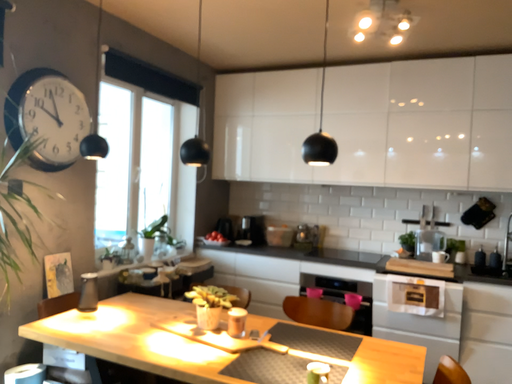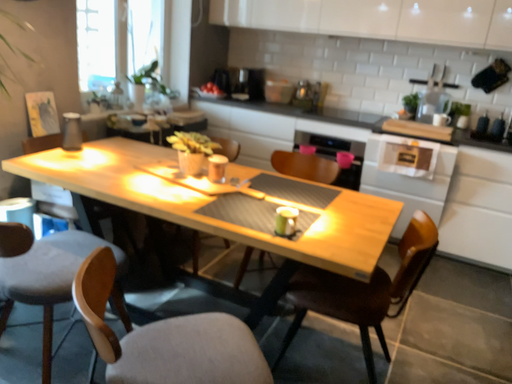
Question: How did the camera likely rotate when shooting the video?

Choices:
 (A) rotated downward
 (B) rotated upward

Answer: (A)